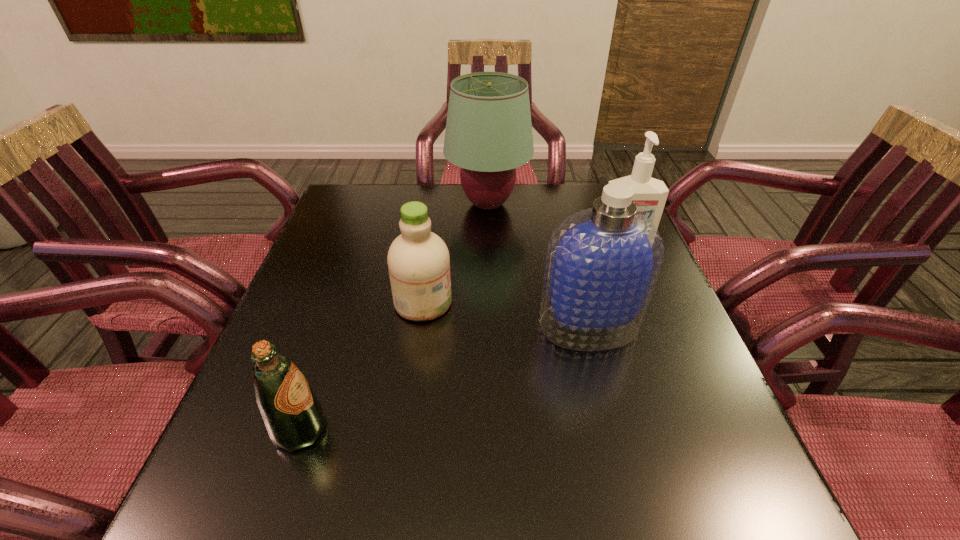
The image size is (960, 540). Find the location of `free space in the image that satisfies the following two spatial constraints: 1. on the front label of the farthest cleansing agent; 2. on the front-facing side of the leftmost object`. free space in the image that satisfies the following two spatial constraints: 1. on the front label of the farthest cleansing agent; 2. on the front-facing side of the leftmost object is located at coordinates (695, 430).